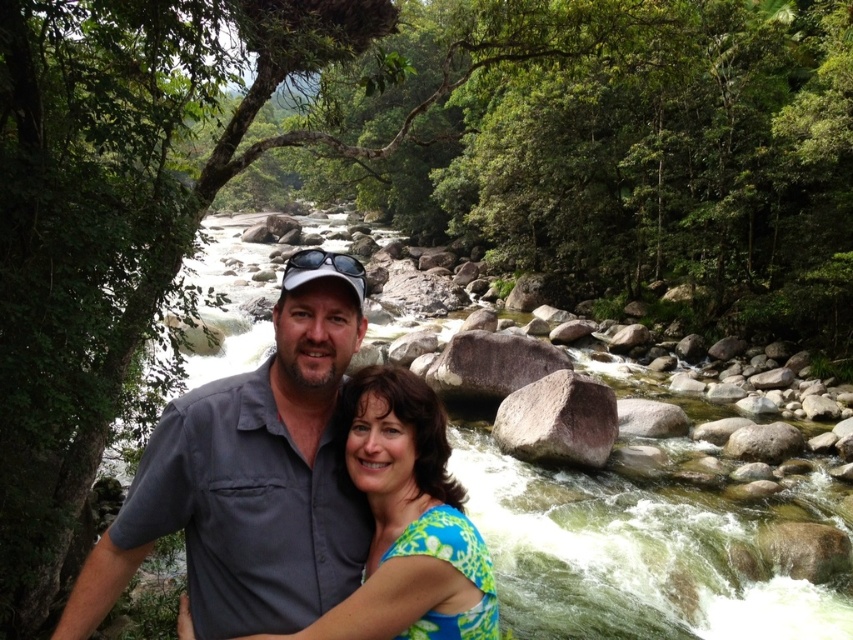
Question: Observing the image, what is the correct spatial positioning of gray fabric shirt at center in reference to green floral dress at center?

Choices:
 (A) above
 (B) below

Answer: (A)

Question: Which object appears farthest from the camera in this image?

Choices:
 (A) gray smooth rock at center-right
 (B) smooth gray rock at center

Answer: (B)

Question: Estimate the real-world distances between objects in this image. Which object is closer to the green floral dress at center?

Choices:
 (A) gray smooth rock at center-right
 (B) smooth gray rock at center

Answer: (A)

Question: Does gray fabric shirt at center have a greater width compared to smooth gray rock at center?

Choices:
 (A) yes
 (B) no

Answer: (B)

Question: Among these objects, which one is farthest from the camera?

Choices:
 (A) smooth gray rock at center
 (B) green floral dress at center
 (C) gray smooth rock at center-right
 (D) gray fabric shirt at center

Answer: (A)

Question: Does green floral dress at center have a smaller size compared to gray smooth rock at center-right?

Choices:
 (A) yes
 (B) no

Answer: (A)